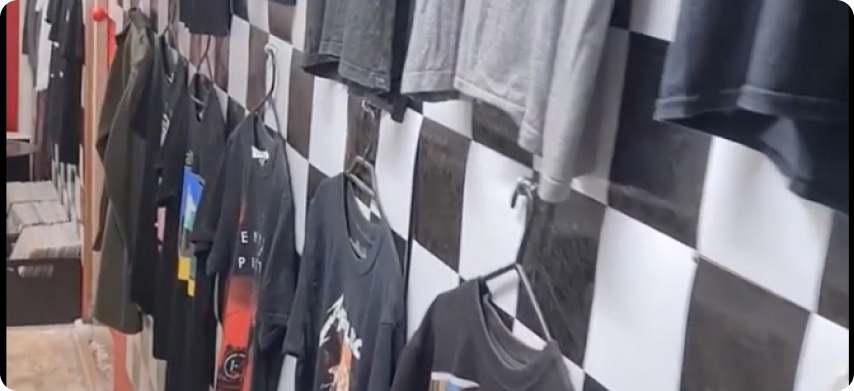
At what (x,y) coordinates should I click in order to perform the action: click on hanger. Please return your answer as a coordinate pair (x, y). Image resolution: width=854 pixels, height=391 pixels. Looking at the image, I should click on (527, 280), (355, 175), (266, 102), (202, 61), (167, 38).